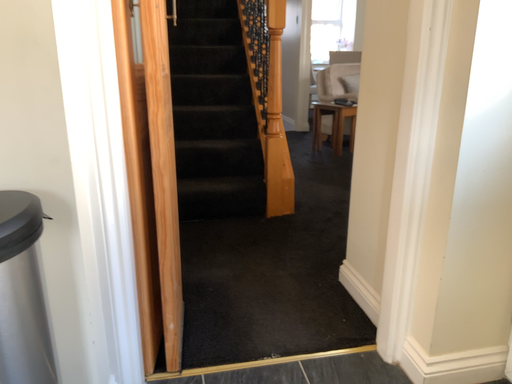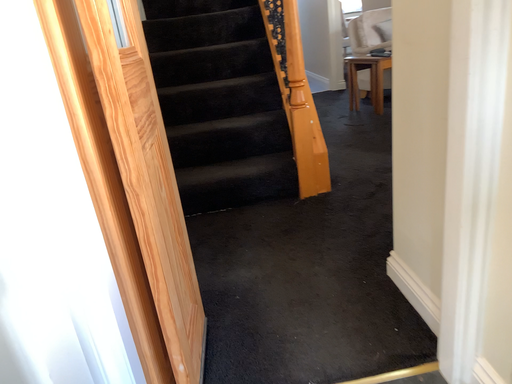
Question: Which way did the camera rotate in the video?

Choices:
 (A) rotated right
 (B) rotated left

Answer: (B)